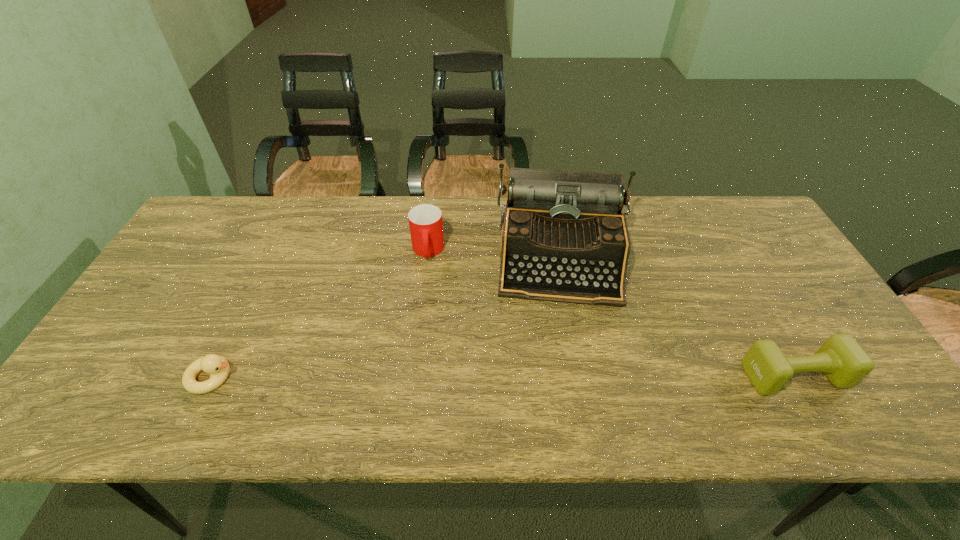
Locate an element on the screen. The image size is (960, 540). free point located on the keyboard of the typewriter is located at coordinates (567, 343).

This screenshot has width=960, height=540. I want to click on free space located 0.210m on the keyboard of the typewriter, so click(x=568, y=379).

This screenshot has width=960, height=540. Find the location of `vacant space located 0.140m on the keyboard of the typewriter`. vacant space located 0.140m on the keyboard of the typewriter is located at coordinates (567, 354).

Find the location of a particular element. vacant space located on the side of the third shortest object with the handle is located at coordinates (424, 307).

Where is `vacant position located on the side of the third shortest object with the handle`? vacant position located on the side of the third shortest object with the handle is located at coordinates (425, 295).

Locate an element on the screen. The image size is (960, 540). vacant space located 0.270m on the side of the third shortest object with the handle is located at coordinates (422, 344).

At what (x,y) coordinates should I click in order to perform the action: click on typewriter present at the far edge. Please return your answer as a coordinate pair (x, y). This screenshot has height=540, width=960. Looking at the image, I should click on (564, 238).

The height and width of the screenshot is (540, 960). I want to click on cup at the far edge, so pyautogui.click(x=425, y=221).

Image resolution: width=960 pixels, height=540 pixels. I want to click on duckling present at the near edge, so click(x=218, y=367).

The image size is (960, 540). In order to click on dumbbell at the near edge in this screenshot , I will do `click(843, 361)`.